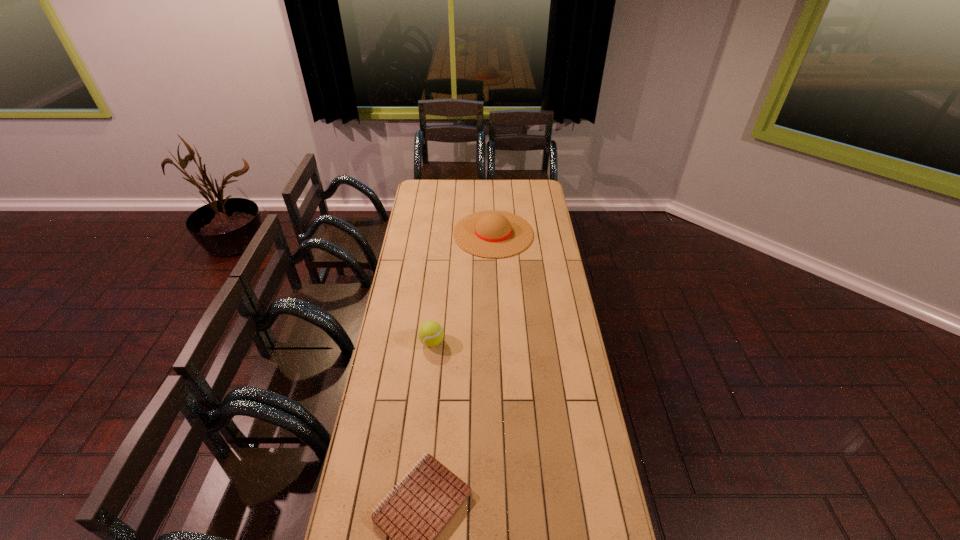
Find the location of a particular element. The image size is (960, 540). vacant space at the far right corner of the desktop is located at coordinates (531, 180).

Where is `free space between the tennis ball and the farthest object`? free space between the tennis ball and the farthest object is located at coordinates (463, 288).

The width and height of the screenshot is (960, 540). I want to click on vacant area between the bonnet and the tennis ball, so click(x=463, y=288).

I want to click on object that is the closest to the second farthest object, so click(415, 513).

Locate which object ranks second in proximity to the bonnet. Please provide its 2D coordinates. Your answer should be formatted as a tuple, i.e. [(x, y)], where the tuple contains the x and y coordinates of a point satisfying the conditions above.

[(415, 513)]

This screenshot has height=540, width=960. I want to click on vacant region that satisfies the following two spatial constraints: 1. on the back side of the tennis ball; 2. on the right side of the farthest object, so click(x=444, y=233).

In order to click on vacant point that satisfies the following two spatial constraints: 1. on the back side of the bonnet; 2. on the right side of the second nearest object in this screenshot , I will do `click(444, 233)`.